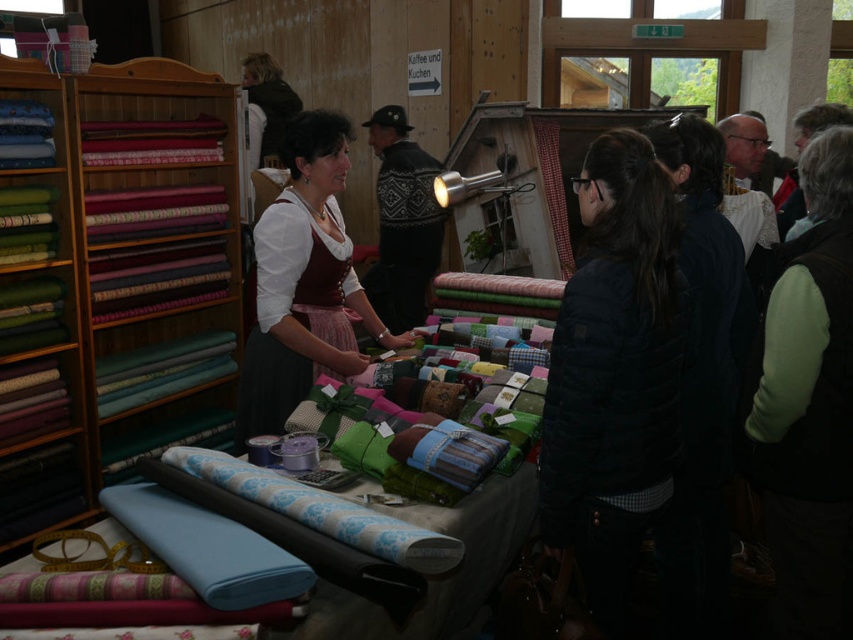
Question: Observing the image, what is the correct spatial positioning of green fleece vest at right in reference to matte brown skirt at center?

Choices:
 (A) above
 (B) below

Answer: (B)

Question: Among these points, which one is farthest from the camera?

Choices:
 (A) (323, 193)
 (B) (123, 228)

Answer: (B)

Question: Based on their relative distances, which object is farther from the knitted sweater at center?

Choices:
 (A) matte green fabric at left
 (B) green fleece vest at right
 (C) matte brown skirt at center
 (D) black quilted jacket at center

Answer: (D)

Question: Considering the relative positions of green fleece vest at right and matte brown skirt at center in the image provided, where is green fleece vest at right located with respect to matte brown skirt at center?

Choices:
 (A) above
 (B) below

Answer: (B)

Question: Which of the following is the farthest from the observer?

Choices:
 (A) (776, 563)
 (B) (341, 330)
 (C) (62, 432)
 (D) (415, 252)

Answer: (D)

Question: Does black quilted jacket at center appear on the right side of matte brown skirt at center?

Choices:
 (A) yes
 (B) no

Answer: (A)